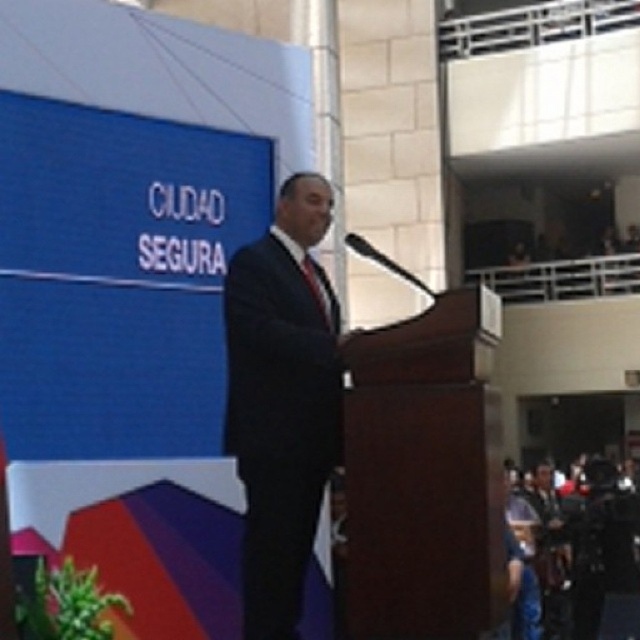
Which is more to the left, dark suit at center or red silk tie at center?

dark suit at center

At what (x,y) coordinates should I click in order to perform the action: click on dark suit at center. Please return your answer as a coordinate pair (x, y). The width and height of the screenshot is (640, 640). Looking at the image, I should click on (282, 403).

Where is `dark suit at center`? This screenshot has width=640, height=640. dark suit at center is located at coordinates (282, 403).